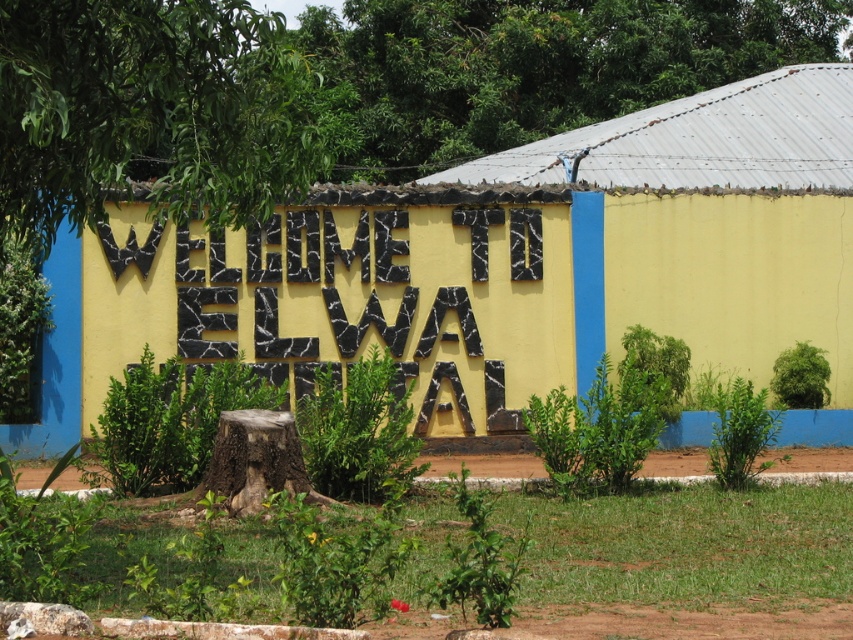
You are a GUI agent. You are given a task and a screenshot of the screen. Output one action in this format:
    pyautogui.click(x=<x>, y=<y>)
    Task: Click on the black stone letters at center
    The height and width of the screenshot is (640, 853).
    Given the screenshot: What is the action you would take?
    pyautogui.click(x=349, y=301)

Is point (421, 220) closer to viewer compared to point (230, 440)?

No, (421, 220) is further to viewer.

What do you see at coordinates (349, 301) in the screenshot? I see `black stone letters at center` at bounding box center [349, 301].

Where is `black stone letters at center`? Image resolution: width=853 pixels, height=640 pixels. black stone letters at center is located at coordinates (349, 301).

Can you confirm if yellow painted wall at center is positioned to the right of brown rough tree stump at center?

Indeed, yellow painted wall at center is positioned on the right side of brown rough tree stump at center.

Is the position of yellow painted wall at center less distant than that of brown rough tree stump at center?

No, yellow painted wall at center is further to the viewer.

Between point (442, 257) and point (279, 452), which one is positioned in front?

Point (279, 452) is in front.

Image resolution: width=853 pixels, height=640 pixels. In order to click on yellow painted wall at center in this screenshot , I will do click(500, 266).

Is yellow painted wall at center below black stone letters at center?

Actually, yellow painted wall at center is above black stone letters at center.

Is point (584, 321) closer to viewer compared to point (405, 349)?

No, (584, 321) is further to viewer.

You are a GUI agent. You are given a task and a screenshot of the screen. Output one action in this format:
    pyautogui.click(x=<x>, y=<y>)
    Task: Click on the yellow painted wall at center
    The height and width of the screenshot is (640, 853).
    Given the screenshot: What is the action you would take?
    pyautogui.click(x=500, y=266)